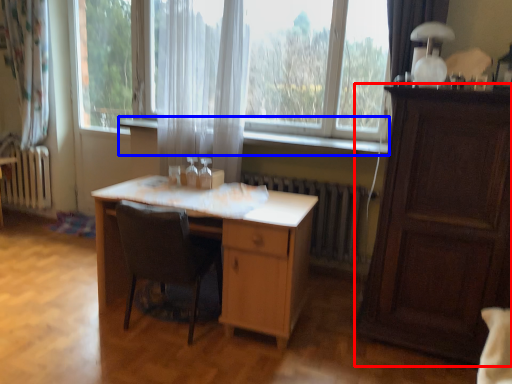
Question: Which object appears farthest to the camera in this image, cabinetry (highlighted by a red box) or window sill (highlighted by a blue box)?

Choices:
 (A) cabinetry
 (B) window sill

Answer: (B)